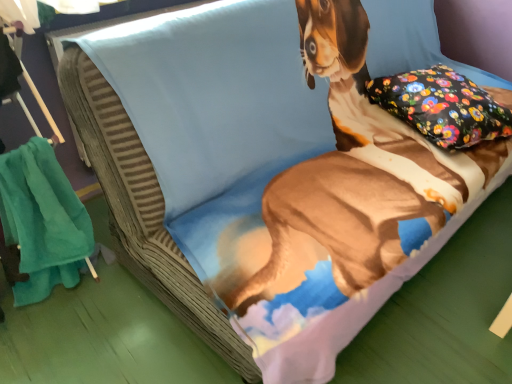
Where is `vacant space in front of teal soft towel at left`? The image size is (512, 384). vacant space in front of teal soft towel at left is located at coordinates (63, 352).